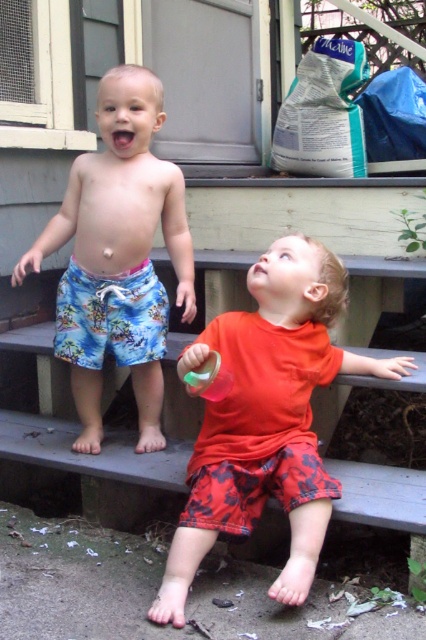
Question: Which point is farther to the camera?

Choices:
 (A) (275, 330)
 (B) (143, 378)

Answer: (B)

Question: Where is matte orange t-shirt at center located in relation to blue floral shorts at left in the image?

Choices:
 (A) right
 (B) left

Answer: (A)

Question: Is matte orange t-shirt at center closer to the viewer compared to blue floral shorts at left?

Choices:
 (A) yes
 (B) no

Answer: (A)

Question: Where is matte orange t-shirt at center located in relation to blue floral shorts at left in the image?

Choices:
 (A) below
 (B) above

Answer: (A)

Question: Among these points, which one is farthest from the camera?

Choices:
 (A) (296, 269)
 (B) (149, 122)

Answer: (B)

Question: Which point appears farthest from the camera in this image?

Choices:
 (A) (241, 477)
 (B) (160, 336)

Answer: (B)